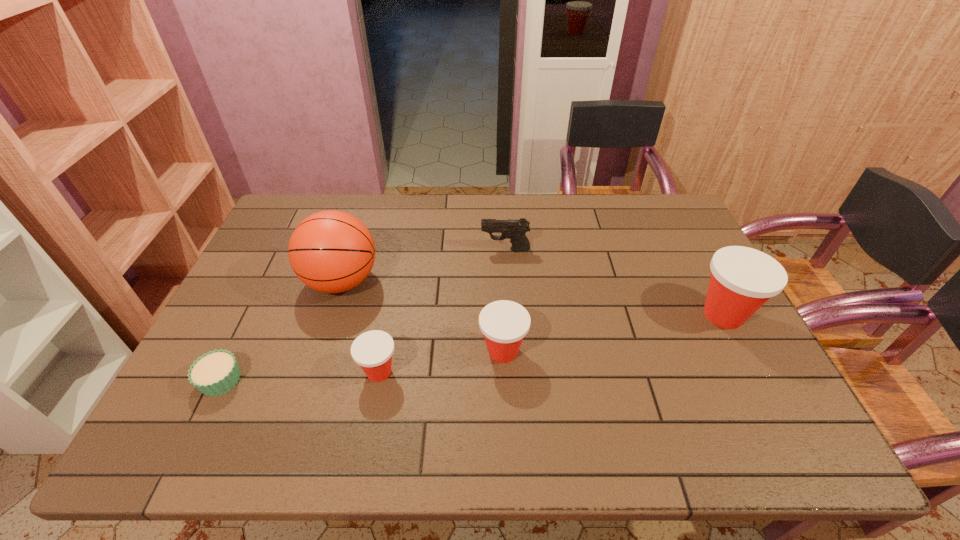
Find the location of a particular element. vacant area in the image that satisfies the following two spatial constraints: 1. at the barrel of the rightmost object; 2. on the left side of the pistol is located at coordinates (510, 315).

This screenshot has width=960, height=540. Find the location of `vacant space that satisfies the following two spatial constraints: 1. at the barrel of the pistol; 2. on the front side of the tallest object`. vacant space that satisfies the following two spatial constraints: 1. at the barrel of the pistol; 2. on the front side of the tallest object is located at coordinates (508, 281).